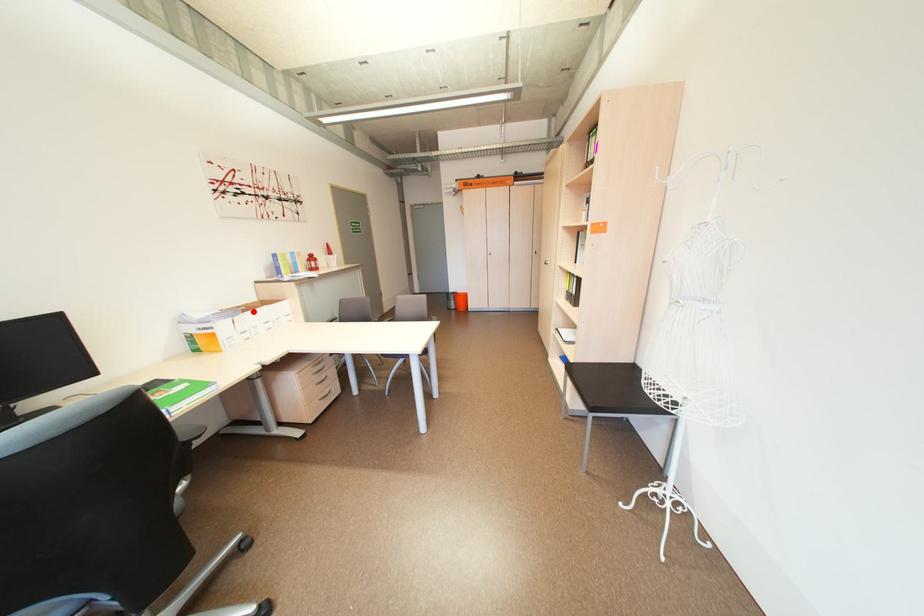
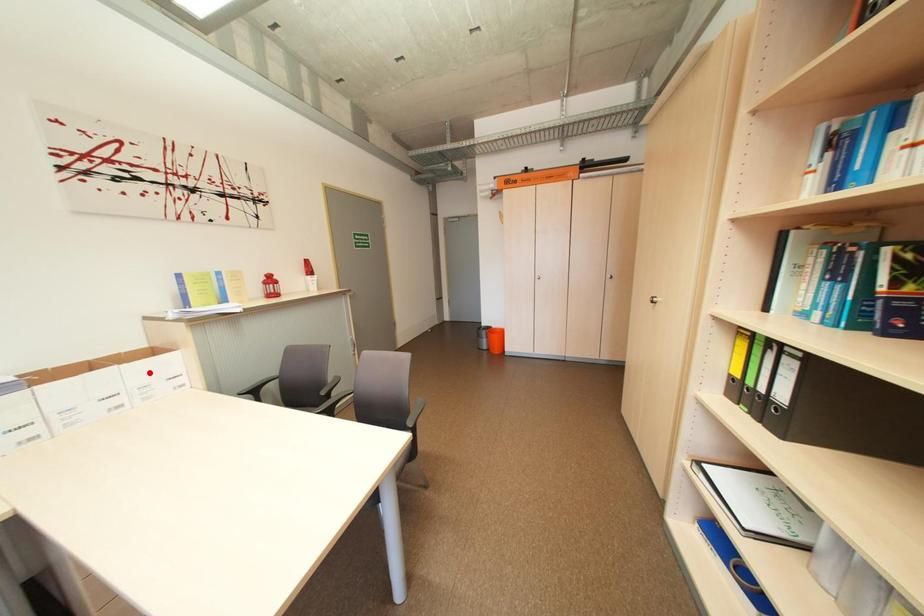
I am providing you with two images of the same scene from different viewpoints. A red point is marked on the first image and another point is marked on the second image. Do the highlighted points in image1 and image2 indicate the same real-world spot?

No